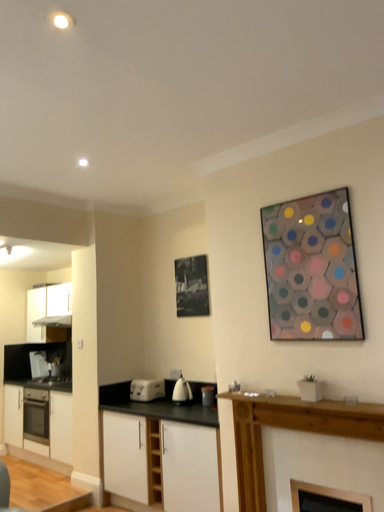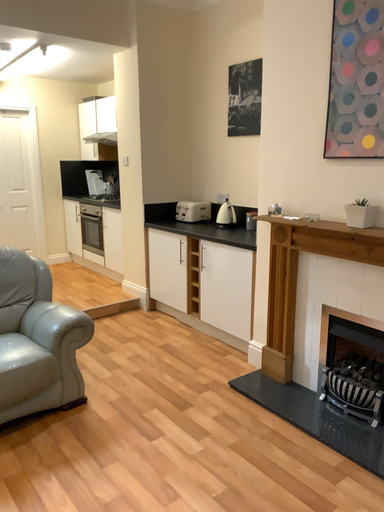
Question: Which way did the camera rotate in the video?

Choices:
 (A) rotated upward
 (B) rotated downward

Answer: (B)